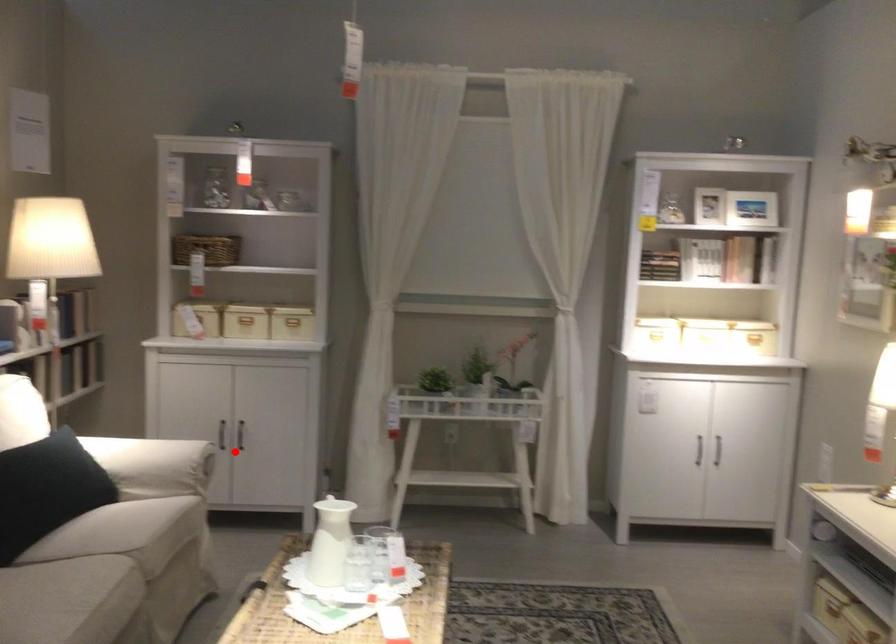
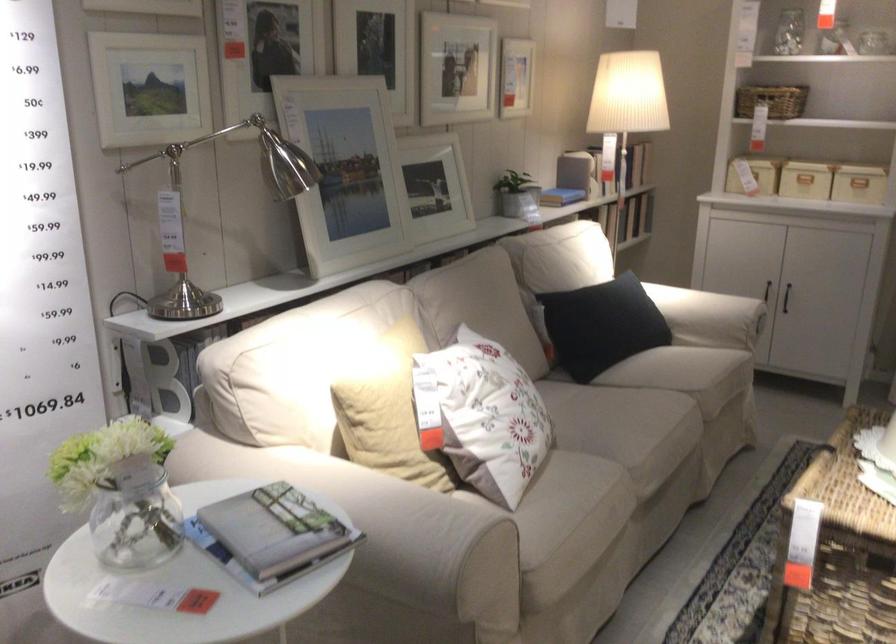
Find the pixel in the second image that matches the highlighted location in the first image.

(786, 297)